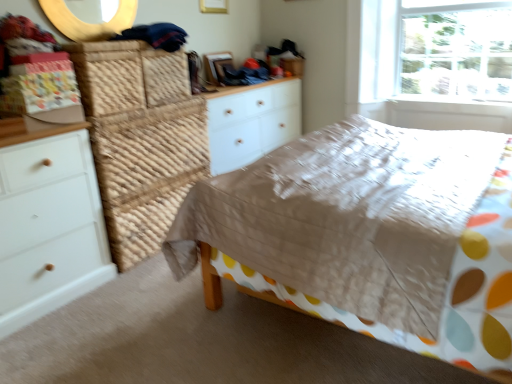
Question: From the image's perspective, is matte brown bed at center on top of white wood chest of drawers at left, which ranks as the first chest of drawers in front-to-back order?

Choices:
 (A) no
 (B) yes

Answer: (B)

Question: Would you say matte brown bed at center contains white wood chest of drawers at left, arranged as the 2th chest of drawers when viewed from the right?

Choices:
 (A) yes
 (B) no

Answer: (B)

Question: Is matte brown bed at center looking in the opposite direction of white wood chest of drawers at left, arranged as the 2th chest of drawers when viewed from the right?

Choices:
 (A) no
 (B) yes

Answer: (A)

Question: Would you consider matte brown bed at center to be distant from white wood chest of drawers at left, the 1th chest of drawers positioned from the left?

Choices:
 (A) yes
 (B) no

Answer: (A)

Question: Considering the relative sizes of matte brown bed at center and white wood chest of drawers at left, arranged as the 2th chest of drawers when viewed from the right, in the image provided, is matte brown bed at center taller than white wood chest of drawers at left, arranged as the 2th chest of drawers when viewed from the right,?

Choices:
 (A) yes
 (B) no

Answer: (B)

Question: From a real-world perspective, is transparent glass window at upper right positioned above or below white wood chest of drawers at center, which ranks as the first chest of drawers in back-to-front order?

Choices:
 (A) below
 (B) above

Answer: (B)

Question: In terms of size, does transparent glass window at upper right appear bigger or smaller than white wood chest of drawers at center, which ranks as the first chest of drawers in back-to-front order?

Choices:
 (A) small
 (B) big

Answer: (A)

Question: Relative to white wood chest of drawers at center, the 2th chest of drawers from the left, is transparent glass window at upper right in front or behind?

Choices:
 (A) behind
 (B) front

Answer: (A)

Question: From the image's perspective, is transparent glass window at upper right above or below white wood chest of drawers at center, the second chest of drawers positioned from the front?

Choices:
 (A) above
 (B) below

Answer: (A)

Question: Is matte brown bed at center taller or shorter than white wood chest of drawers at left, the 1th chest of drawers positioned from the left?

Choices:
 (A) short
 (B) tall

Answer: (A)

Question: From the image's perspective, relative to white wood chest of drawers at left, which ranks as the first chest of drawers in front-to-back order, is matte brown bed at center above or below?

Choices:
 (A) below
 (B) above

Answer: (B)

Question: Would you say matte brown bed at center is inside or outside white wood chest of drawers at left, which is the second chest of drawers in back-to-front order?

Choices:
 (A) inside
 (B) outside

Answer: (B)

Question: In terms of width, does matte brown bed at center look wider or thinner when compared to white wood chest of drawers at left, the 1th chest of drawers positioned from the left?

Choices:
 (A) thin
 (B) wide

Answer: (B)

Question: Is wooden round mirror at upper center spatially inside matte brown bed at center, or outside of it?

Choices:
 (A) outside
 (B) inside

Answer: (A)

Question: Looking at their shapes, would you say wooden round mirror at upper center is wider or thinner than matte brown bed at center?

Choices:
 (A) wide
 (B) thin

Answer: (B)